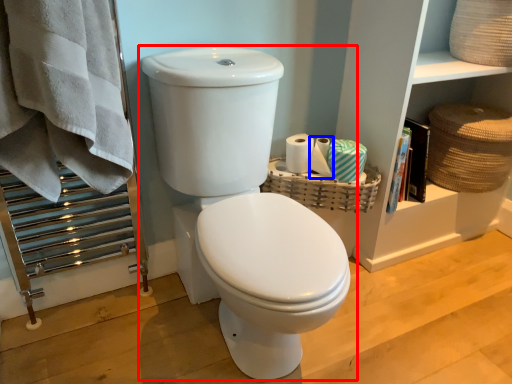
Question: Which object is closer to the camera taking this photo, toilet (highlighted by a red box) or toilet paper (highlighted by a blue box)?

Choices:
 (A) toilet
 (B) toilet paper

Answer: (A)